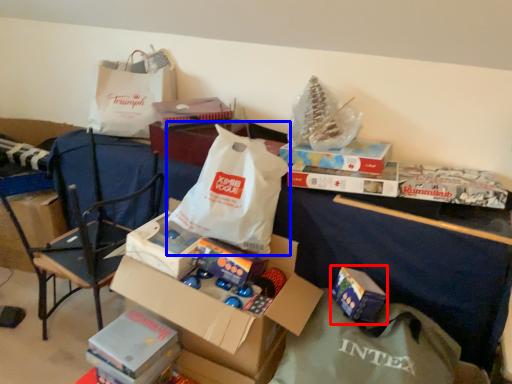
Question: Which object appears farthest to the camera in this image, gift (highlighted by a red box) or grocery bag (highlighted by a blue box)?

Choices:
 (A) gift
 (B) grocery bag

Answer: (A)